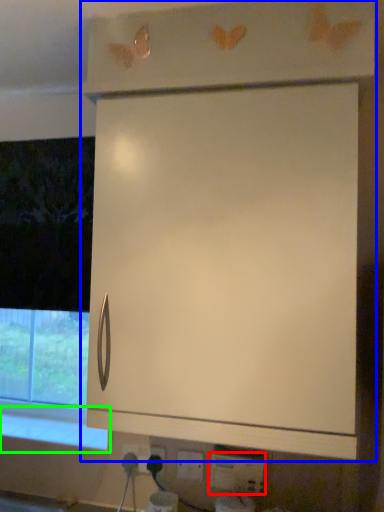
Question: Which object is positioned closest to electric outlet (highlighted by a red box)? Select from cabinetry (highlighted by a blue box) and window sill (highlighted by a green box).

Choices:
 (A) cabinetry
 (B) window sill

Answer: (B)